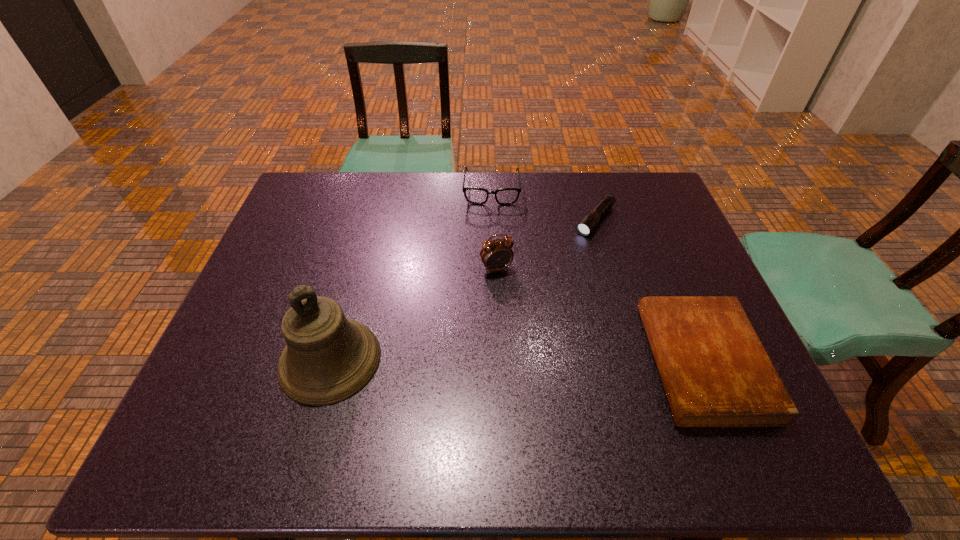
You are a GUI agent. You are given a task and a screenshot of the screen. Output one action in this format:
    pyautogui.click(x=<x>, y=<y>)
    Task: Click on the vacant region at the left edge
    The image size is (960, 540).
    Given the screenshot: What is the action you would take?
    pyautogui.click(x=252, y=285)

You are a GUI agent. You are given a task and a screenshot of the screen. Output one action in this format:
    pyautogui.click(x=<x>, y=<y>)
    Task: Click on the free space at the far left corner of the desktop
    This screenshot has width=960, height=540.
    Given the screenshot: What is the action you would take?
    pyautogui.click(x=324, y=185)

Where is `blank space at the far right corner of the desktop`? This screenshot has height=540, width=960. blank space at the far right corner of the desktop is located at coordinates (635, 187).

You are a GUI agent. You are given a task and a screenshot of the screen. Output one action in this format:
    pyautogui.click(x=<x>, y=<y>)
    Task: Click on the free spot between the tallest object and the third farthest object
    
    Given the screenshot: What is the action you would take?
    pyautogui.click(x=414, y=314)

Find the location of a particular element. Image resolution: width=960 pixels, height=540 pixels. empty space between the leftmost object and the spectacles is located at coordinates (411, 275).

Where is `free spot between the tallest object and the third tallest object`? This screenshot has width=960, height=540. free spot between the tallest object and the third tallest object is located at coordinates (411, 275).

Find the location of a particular element. vacant area between the Bible and the spectacles is located at coordinates [x=597, y=276].

The width and height of the screenshot is (960, 540). I want to click on free point between the alarm clock and the third shortest object, so click(x=493, y=230).

Locate an element on the screen. This screenshot has height=540, width=960. unoccupied area between the tallest object and the alarm clock is located at coordinates (414, 314).

Where is `unoccupied position between the spectacles and the third nearest object`? The width and height of the screenshot is (960, 540). unoccupied position between the spectacles and the third nearest object is located at coordinates (493, 230).